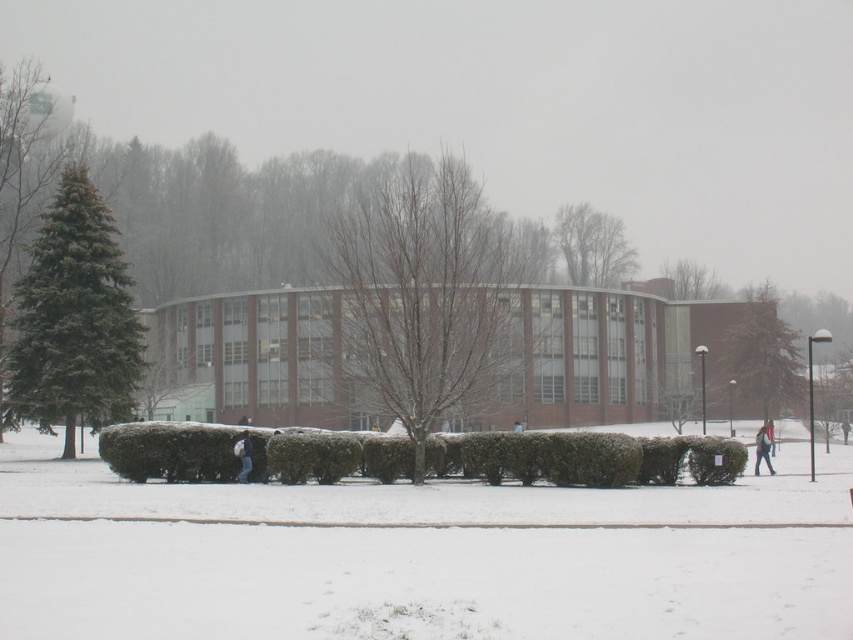
You are a bird looking for a place to land. You see the bare branches at upper center and the bare branches tree at center. Which one is located to the right side of the other?

The bare branches at upper center is to the right of the bare branches tree at center.